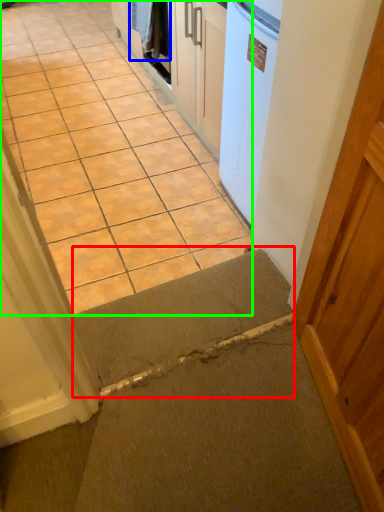
Question: Which is farther away from doormat (highlighted by a red box)? laundry (highlighted by a blue box) or concrete (highlighted by a green box)?

Choices:
 (A) laundry
 (B) concrete

Answer: (A)